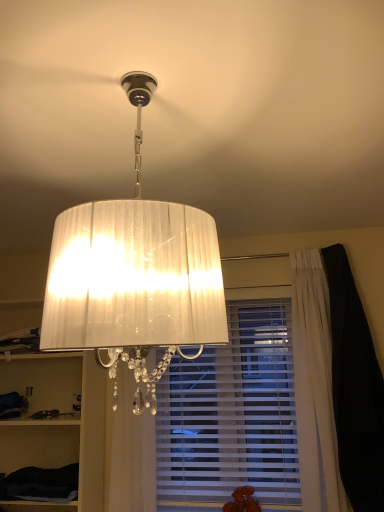
Question: From the image's perspective, relative to white fabric cabinet at left, the first cabinet when ordered from top to bottom, is white sheer curtain at center above or below?

Choices:
 (A) below
 (B) above

Answer: (A)

Question: Is white sheer curtain at center bigger or smaller than white fabric cabinet at left, the first cabinet when ordered from top to bottom?

Choices:
 (A) small
 (B) big

Answer: (A)

Question: Which is nearer to the dark fabric cabinet at lower left, which appears as the second cabinet when viewed from the top?

Choices:
 (A) black velvet curtain at right
 (B) white fabric cabinet at left, which ranks as the 2th cabinet in bottom-to-top order
 (C) white sheer curtain at center
 (D) white pleated curtain at lower center
 (E) white pleated fabric lampshade at upper center

Answer: (B)

Question: Considering the real-world distances, which object is closest to the white pleated fabric lampshade at upper center?

Choices:
 (A) white sheer curtain at center
 (B) dark fabric cabinet at lower left, which is the first cabinet in bottom-to-top order
 (C) white pleated curtain at lower center
 (D) black velvet curtain at right
 (E) white fabric cabinet at left, the first cabinet when ordered from top to bottom

Answer: (A)